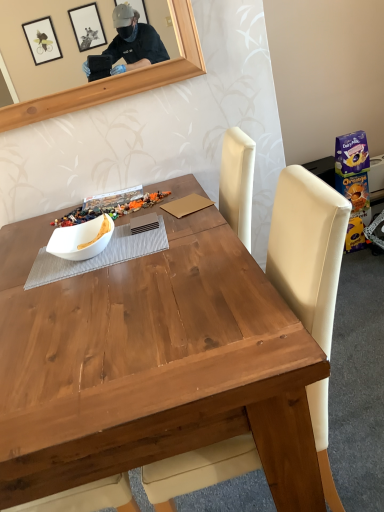
Find the location of a particular element. The height and width of the screenshot is (512, 384). vacant area situated to the left side of white matte bowl at center is located at coordinates (26, 280).